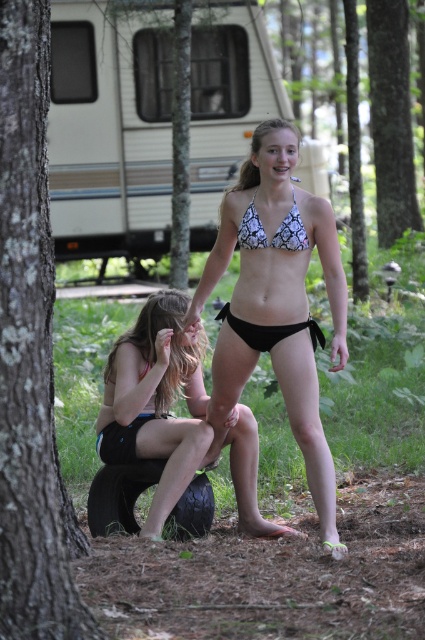
Locate an element on the screen. smooth bark tree at center is located at coordinates (391, 118).

The image size is (425, 640). What do you see at coordinates (391, 118) in the screenshot?
I see `smooth bark tree at center` at bounding box center [391, 118].

At what (x,y) coordinates should I click in order to perform the action: click on smooth bark tree at center. Please return your answer as a coordinate pair (x, y). Looking at the image, I should click on (391, 118).

Does beige plastic camper at upper center lie in front of snake print bikini top at center?

No.

I want to click on beige plastic camper at upper center, so click(x=108, y=132).

Describe the element at coordinates (108, 132) in the screenshot. This screenshot has height=640, width=425. I see `beige plastic camper at upper center` at that location.

You are a GUI agent. You are given a task and a screenshot of the screen. Output one action in this format:
    pyautogui.click(x=<x>, y=<y>)
    Task: Click on the beige plastic camper at upper center
    
    Given the screenshot: What is the action you would take?
    pyautogui.click(x=108, y=132)

Does white printed bikini at center have a lesser height compared to black bikini at center?

In fact, white printed bikini at center may be taller than black bikini at center.

Which of these two, white printed bikini at center or black bikini at center, stands shorter?

black bikini at center is shorter.

Which is in front, point (317, 250) or point (255, 182)?

Point (317, 250)

Locate an element on the screen. The image size is (425, 640). white printed bikini at center is located at coordinates (277, 301).